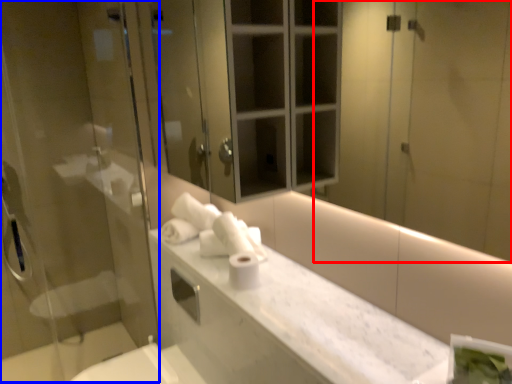
Question: Among these objects, which one is farthest to the camera, mirror (highlighted by a red box) or screen door (highlighted by a blue box)?

Choices:
 (A) mirror
 (B) screen door

Answer: (B)